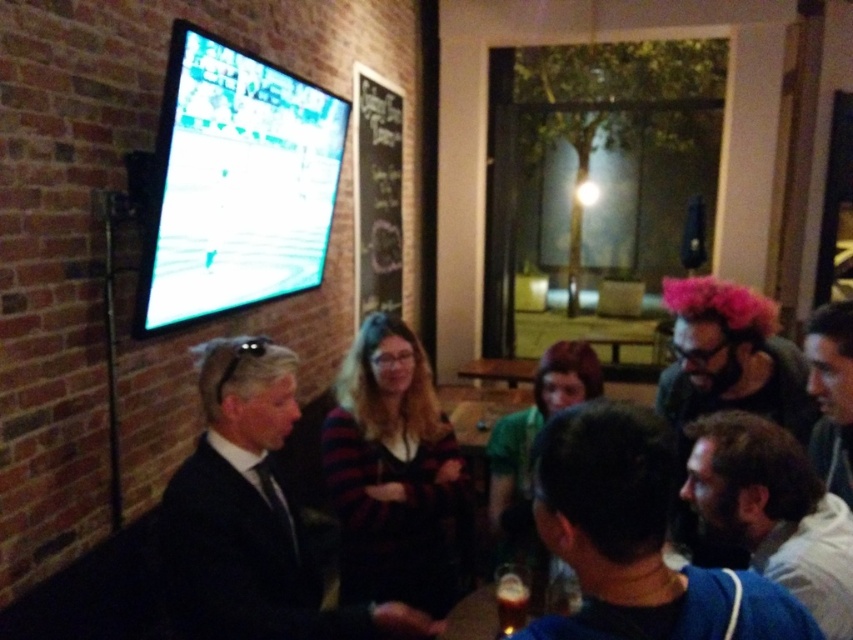
Question: Does black suit at center appear under dark blue t-shirt at center?

Choices:
 (A) yes
 (B) no

Answer: (A)

Question: Among these objects, which one is farthest from the camera?

Choices:
 (A) dark blue t-shirt at center
 (B) black suit at center
 (C) smooth black hair at lower right
 (D) translucent glass beer at lower center

Answer: (D)

Question: Estimate the real-world distances between objects in this image. Which object is farther from the dark blue fabric at lower right?

Choices:
 (A) translucent glass beer at lower center
 (B) black suit at center
 (C) smooth black hair at lower right

Answer: (B)

Question: Is dark blue t-shirt at center positioned behind pink fuzzy wig at upper right?

Choices:
 (A) no
 (B) yes

Answer: (A)

Question: Based on their relative distances, which object is farther from the black suit at center?

Choices:
 (A) pink fuzzy wig at upper right
 (B) translucent glass beer at lower center
 (C) smooth black hair at lower right

Answer: (C)

Question: Does smooth black hair at lower right have a lesser width compared to translucent glass beer at lower center?

Choices:
 (A) yes
 (B) no

Answer: (B)